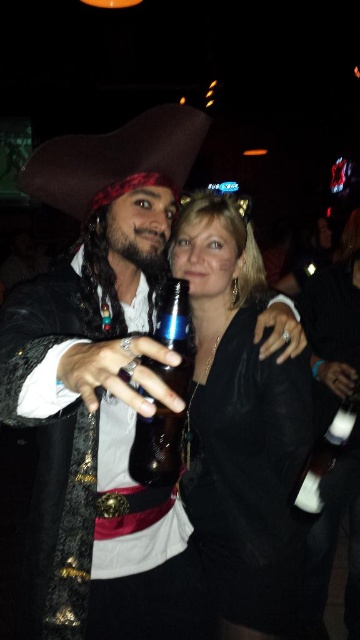
Question: Which point is closer to the camera taking this photo?

Choices:
 (A) (135, 449)
 (B) (62, 516)
 (C) (217, 259)

Answer: (A)

Question: Which of the following is the closest to the observer?

Choices:
 (A) (158, 538)
 (B) (257, 561)

Answer: (A)

Question: Is matte black pirate hat at upper left to the right of black velvet dress at center from the viewer's perspective?

Choices:
 (A) no
 (B) yes

Answer: (A)

Question: Is matte black pirate hat at upper left above shiny metallic bottle at center?

Choices:
 (A) yes
 (B) no

Answer: (B)

Question: Can you confirm if matte black pirate hat at upper left is positioned above shiny metallic bottle at center?

Choices:
 (A) yes
 (B) no

Answer: (B)

Question: Estimate the real-world distances between objects in this image. Which object is farther from the matte black pirate hat at upper left?

Choices:
 (A) shiny metallic bottle at center
 (B) black velvet dress at center

Answer: (A)